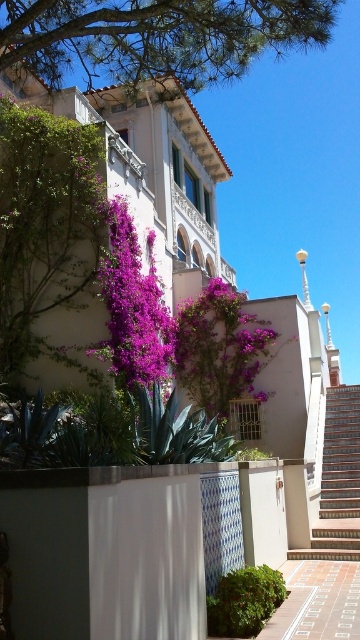
You are a visitor standing in front of the building and want to take a photo that includes both the green leafy tree at upper center and the purple matte flowers at center. Which object should you focus on first to ensure both are in the frame?

The green leafy tree at upper center is shorter than the purple matte flowers at center, so you should focus on the purple matte flowers at center first to ensure both are in the frame.

From the picture: You are a visitor approaching the entrance of the building and want to take a photo of the purple leafy plant at upper left and terracotta tiled stairs at center. To ensure both are in the frame, where should you position yourself relative to the building?

You should position yourself below the purple leafy plant at upper left and terracotta tiled stairs at center because the purple leafy plant at upper left is located above the terracotta tiled stairs at center, so standing below them will allow both to be captured in the photo.

From the picture: You are a visitor standing in front of the building and want to take a photo that includes both the purple matte flowers at center and the green leafy bush at lower center. Which object should you focus on first to ensure both are in the frame?

You should focus on the purple matte flowers at center first because it is taller than the green leafy bush at lower center, so adjusting the camera angle to include its height will naturally include the shorter bush in the frame.